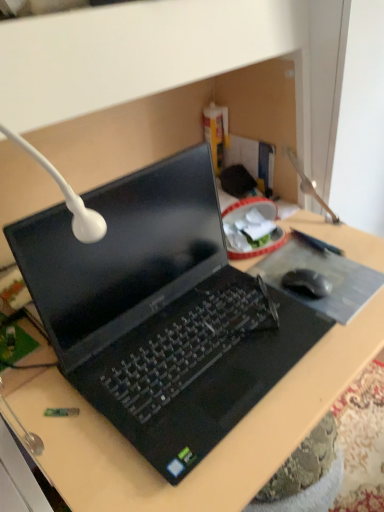
Question: Is black rubber mouse at right inside the boundaries of black plastic laptop at center, or outside?

Choices:
 (A) outside
 (B) inside

Answer: (A)

Question: Is black rubber mouse at right in front of or behind black plastic laptop at center in the image?

Choices:
 (A) behind
 (B) front

Answer: (A)

Question: Which is farther from the black matte mousepad at center?

Choices:
 (A) black plastic laptop at center
 (B) black rubber mouse at right

Answer: (A)

Question: Estimate the real-world distances between objects in this image. Which object is closer to the black rubber mouse at right?

Choices:
 (A) black matte mousepad at center
 (B) black plastic laptop at center

Answer: (A)